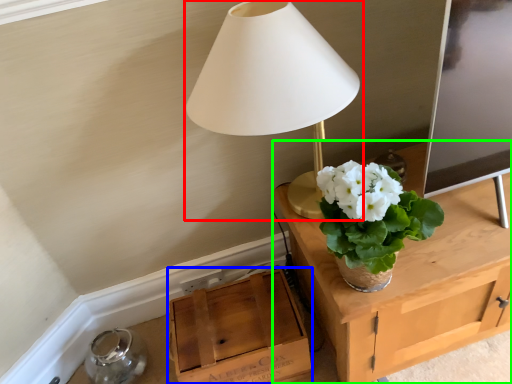
Question: Estimate the real-world distances between objects in this image. Which object is farther from lamp (highlighted by a red box), cardboard box (highlighted by a blue box) or table (highlighted by a green box)?

Choices:
 (A) cardboard box
 (B) table

Answer: (A)